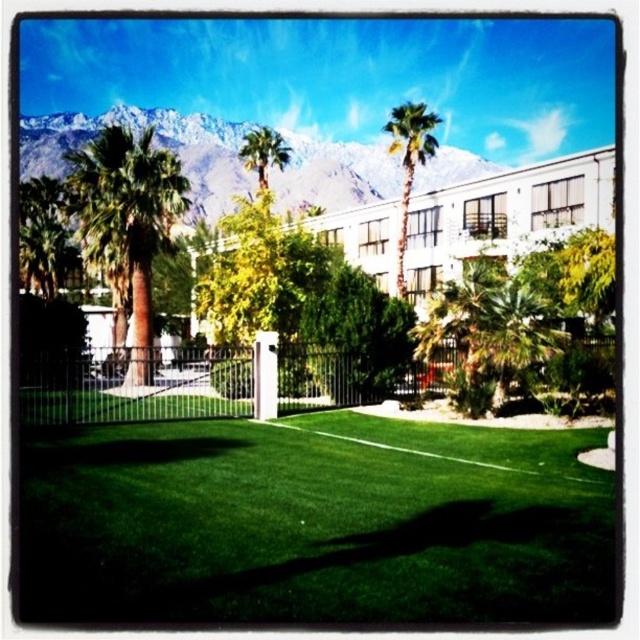
Consider the image. You are planning to install a new lighting system for the property. The lights need to be placed at the base of the tallest palm tree. Which palm tree should you choose between the brown textured palm tree at left and the green leafy palm tree at upper center?

The green leafy palm tree at upper center is taller than the brown textured palm tree at left, so you should install the lighting system at the base of the green leafy palm tree at upper center.

You are a gardener who needs to mow the lawn. You see the green artificial turf at lower center and the green leafy palm tree at upper center. Which one requires mowing?

The green artificial turf at lower center requires mowing because it is shorter than the green leafy palm tree at upper center, indicating it is the lawn area.

You are designing a new fence for the property and want to ensure it matches the existing one. Given that the white metal fence at center is currently thinner than the green leafy palm tree at upper center, how does the thickness of the new fence compare to the palm tree?

The white metal fence at center is thinner than the green leafy palm tree at upper center, so the new fence should be designed to maintain this thinner thickness compared to the palm tree to match the existing one.